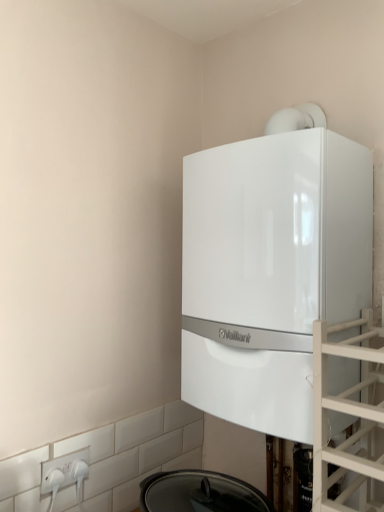
Question: Should I look upward or downward to see white glossy boiler at upper center?

Choices:
 (A) down
 (B) up

Answer: (B)

Question: Is white plastic electric outlet at lower left far from white glossy boiler at upper center?

Choices:
 (A) yes
 (B) no

Answer: (B)

Question: Does white plastic electric outlet at lower left have a smaller size compared to white glossy boiler at upper center?

Choices:
 (A) yes
 (B) no

Answer: (A)

Question: Is white plastic electric outlet at lower left completely or partially outside of white glossy boiler at upper center?

Choices:
 (A) no
 (B) yes

Answer: (B)

Question: Does white plastic electric outlet at lower left have a greater height compared to white glossy boiler at upper center?

Choices:
 (A) yes
 (B) no

Answer: (B)

Question: Is the position of white plastic electric outlet at lower left less distant than that of white glossy boiler at upper center?

Choices:
 (A) no
 (B) yes

Answer: (A)

Question: Can you confirm if white plastic electric outlet at lower left is shorter than white glossy boiler at upper center?

Choices:
 (A) no
 (B) yes

Answer: (B)

Question: Can you confirm if transparent glass door at right is taller than white plastic electric outlet at lower left?

Choices:
 (A) yes
 (B) no

Answer: (A)

Question: Considering the relative sizes of transparent glass door at right and white plastic electric outlet at lower left in the image provided, is transparent glass door at right thinner than white plastic electric outlet at lower left?

Choices:
 (A) no
 (B) yes

Answer: (A)

Question: Can you confirm if transparent glass door at right is positioned to the left of white plastic electric outlet at lower left?

Choices:
 (A) no
 (B) yes

Answer: (A)

Question: Is transparent glass door at right further to camera compared to white plastic electric outlet at lower left?

Choices:
 (A) no
 (B) yes

Answer: (A)

Question: Is transparent glass door at right not near white plastic electric outlet at lower left?

Choices:
 (A) no
 (B) yes

Answer: (A)

Question: Is transparent glass door at right smaller than white plastic electric outlet at lower left?

Choices:
 (A) no
 (B) yes

Answer: (A)

Question: From a real-world perspective, is transparent glass door at right located beneath white glossy boiler at upper center?

Choices:
 (A) yes
 (B) no

Answer: (A)